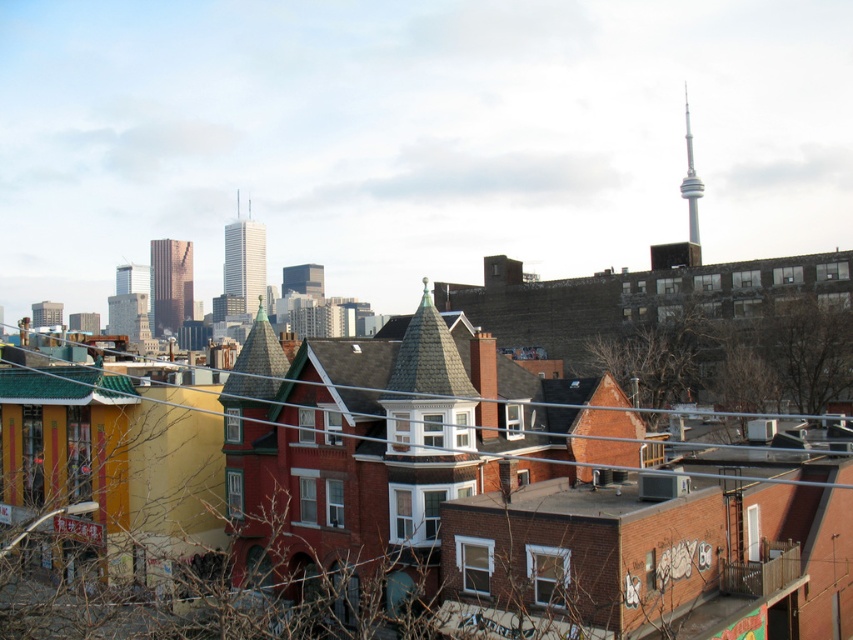
Question: Is metallic wire at lower center smaller than shiny glass skyscraper at center?

Choices:
 (A) no
 (B) yes

Answer: (B)

Question: Which object is the farthest from the shiny glass skyscraper at center?

Choices:
 (A) smooth glass skyscraper at center
 (B) metallic wire at lower center

Answer: (B)

Question: Among these objects, which one is farthest from the camera?

Choices:
 (A) metallic wire at lower center
 (B) smooth glass skyscraper at center

Answer: (B)

Question: Does metallic wire at lower center appear over smooth glass skyscraper at center?

Choices:
 (A) no
 (B) yes

Answer: (A)

Question: Which object is closer to the camera taking this photo?

Choices:
 (A) smooth glass skyscraper at center
 (B) metallic wire at lower center

Answer: (B)

Question: Is metallic wire at lower center behind smooth glass skyscraper at center?

Choices:
 (A) yes
 (B) no

Answer: (B)